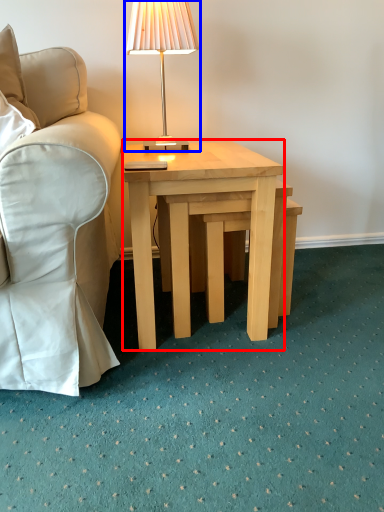
Question: Which point is further to the camera, coffee table (highlighted by a red box) or lamp (highlighted by a blue box)?

Choices:
 (A) coffee table
 (B) lamp

Answer: (B)